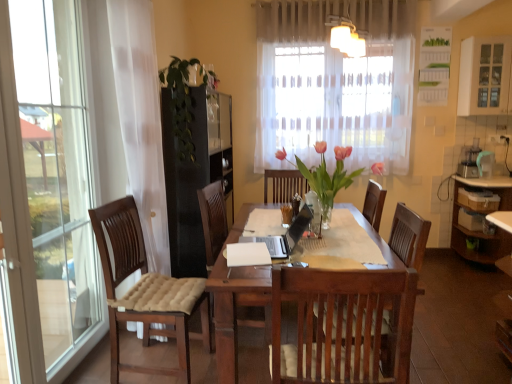
The image size is (512, 384). Describe the element at coordinates (327, 175) in the screenshot. I see `translucent glass vase at center, the second floral arrangement in the back-to-front sequence` at that location.

What do you see at coordinates (484, 75) in the screenshot? I see `white glass cabinet at upper right` at bounding box center [484, 75].

Image resolution: width=512 pixels, height=384 pixels. Find the location of `green leafy plant at center, which is the second floral arrangement in front-to-back order`. green leafy plant at center, which is the second floral arrangement in front-to-back order is located at coordinates (184, 101).

Locate an element on the screen. translucent glass vase at center, the second floral arrangement in the back-to-front sequence is located at coordinates (327, 175).

In the scene shown: How distant is translucent glass vase at center, the second floral arrangement in the back-to-front sequence, from white glass cabinet at upper right?

translucent glass vase at center, the second floral arrangement in the back-to-front sequence, and white glass cabinet at upper right are 6.65 feet apart.

Is translucent glass vase at center, the first floral arrangement positioned from the right, far from white glass cabinet at upper right?

Indeed, translucent glass vase at center, the first floral arrangement positioned from the right, is not near white glass cabinet at upper right.

Which of these two, translucent glass vase at center, the first floral arrangement positioned from the right, or white glass cabinet at upper right, is smaller?

white glass cabinet at upper right is smaller.

Looking at their sizes, would you say translucent glass vase at center, acting as the first floral arrangement starting from the front, is wider or thinner than white glass cabinet at upper right?

Considering their sizes, translucent glass vase at center, acting as the first floral arrangement starting from the front, looks broader than white glass cabinet at upper right.

Based on the photo, is green leafy plant at center, placed as the 1th floral arrangement when sorted from left to right, taller than translucent glass vase at center, the first floral arrangement positioned from the right?

Correct, green leafy plant at center, placed as the 1th floral arrangement when sorted from left to right, is much taller as translucent glass vase at center, the first floral arrangement positioned from the right.

This screenshot has width=512, height=384. Find the location of `floral arrangement above the translucent glass vase at center, acting as the first floral arrangement starting from the front (from a real-world perspective)`. floral arrangement above the translucent glass vase at center, acting as the first floral arrangement starting from the front (from a real-world perspective) is located at coordinates tap(184, 101).

Visually, is green leafy plant at center, which is the second floral arrangement in right-to-left order, positioned to the left or to the right of translucent glass vase at center, acting as the 2th floral arrangement starting from the left?

green leafy plant at center, which is the second floral arrangement in right-to-left order, is positioned on translucent glass vase at center, acting as the 2th floral arrangement starting from the left,'s left side.

Is green leafy plant at center, the first floral arrangement positioned from the back, in contact with translucent glass vase at center, acting as the first floral arrangement starting from the front?

No, green leafy plant at center, the first floral arrangement positioned from the back, is not touching translucent glass vase at center, acting as the first floral arrangement starting from the front.

Is white glass cabinet at upper right located outside green leafy plant at center, which is the second floral arrangement in right-to-left order?

That's correct, white glass cabinet at upper right is outside of green leafy plant at center, which is the second floral arrangement in right-to-left order.

Between white glass cabinet at upper right and green leafy plant at center, which is the second floral arrangement in right-to-left order, which one has larger size?

With larger size is green leafy plant at center, which is the second floral arrangement in right-to-left order.

From the image's perspective, between white glass cabinet at upper right and green leafy plant at center, which is the second floral arrangement in front-to-back order, who is located below?

green leafy plant at center, which is the second floral arrangement in front-to-back order, appears lower in the image.

Considering the positions of objects green leafy plant at center, the first floral arrangement positioned from the back, and white glass cabinet at upper right in the image provided, who is behind, green leafy plant at center, the first floral arrangement positioned from the back, or white glass cabinet at upper right?

white glass cabinet at upper right is further from the camera.

From the image's perspective, which object appears higher, green leafy plant at center, which is the second floral arrangement in right-to-left order, or white glass cabinet at upper right?

white glass cabinet at upper right, from the image's perspective.

Is green leafy plant at center, which is the second floral arrangement in front-to-back order, not near white glass cabinet at upper right?

Indeed, green leafy plant at center, which is the second floral arrangement in front-to-back order, is not near white glass cabinet at upper right.

From the white glass cabinet at upper right, count 1st floral arrangements forward and point to it. Please provide its 2D coordinates.

[(184, 101)]

Could green leafy plant at center, placed as the 1th floral arrangement when sorted from left to right, be considered to be inside translucent glass vase at center, acting as the 2th floral arrangement starting from the left?

That's incorrect, green leafy plant at center, placed as the 1th floral arrangement when sorted from left to right, is not inside translucent glass vase at center, acting as the 2th floral arrangement starting from the left.

In the scene shown: Can you tell me how much translucent glass vase at center, the second floral arrangement in the back-to-front sequence, and green leafy plant at center, placed as the 1th floral arrangement when sorted from left to right, differ in facing direction?

There is a 4.31-degree angle between the facing directions of translucent glass vase at center, the second floral arrangement in the back-to-front sequence, and green leafy plant at center, placed as the 1th floral arrangement when sorted from left to right.

Between translucent glass vase at center, acting as the 2th floral arrangement starting from the left, and green leafy plant at center, placed as the 1th floral arrangement when sorted from left to right, which one has smaller width?

green leafy plant at center, placed as the 1th floral arrangement when sorted from left to right.

From the image's perspective, is white glass cabinet at upper right on translucent glass vase at center, the first floral arrangement positioned from the right?

Yes.

In the scene shown: Considering their positions, is white glass cabinet at upper right located in front of or behind translucent glass vase at center, acting as the 2th floral arrangement starting from the left?

Visually, white glass cabinet at upper right is located behind translucent glass vase at center, acting as the 2th floral arrangement starting from the left.

From a real-world perspective, is white glass cabinet at upper right physically below translucent glass vase at center, acting as the first floral arrangement starting from the front?

No, from a real-world perspective, white glass cabinet at upper right is not beneath translucent glass vase at center, acting as the first floral arrangement starting from the front.

Considering the relative sizes of white glass cabinet at upper right and translucent glass vase at center, the first floral arrangement positioned from the right, in the image provided, is white glass cabinet at upper right smaller than translucent glass vase at center, the first floral arrangement positioned from the right,?

Yes.

At what (x,y) coordinates should I click in order to perform the action: click on floral arrangement that is the 1st one when counting leftward from the white glass cabinet at upper right. Please return your answer as a coordinate pair (x, y). The image size is (512, 384). Looking at the image, I should click on click(327, 175).

Locate an element on the screen. The height and width of the screenshot is (384, 512). floral arrangement below the green leafy plant at center, which is the second floral arrangement in front-to-back order (from a real-world perspective) is located at coordinates (327, 175).

Estimate the real-world distances between objects in this image. Which object is closer to white glass cabinet at upper right, translucent glass vase at center, the first floral arrangement positioned from the right, or green leafy plant at center, which is the second floral arrangement in right-to-left order?

Based on the image, translucent glass vase at center, the first floral arrangement positioned from the right, appears to be nearer to white glass cabinet at upper right.

Based on the photo, estimate the real-world distances between objects in this image. Which object is further from white glass cabinet at upper right, green leafy plant at center, which is the second floral arrangement in right-to-left order, or translucent glass vase at center, the first floral arrangement positioned from the right?

Among the two, green leafy plant at center, which is the second floral arrangement in right-to-left order, is located further to white glass cabinet at upper right.

Estimate the real-world distances between objects in this image. Which object is closer to translucent glass vase at center, acting as the 2th floral arrangement starting from the left, white glass cabinet at upper right or green leafy plant at center, the first floral arrangement positioned from the back?

green leafy plant at center, the first floral arrangement positioned from the back.

Looking at the image, which one is located closer to translucent glass vase at center, the second floral arrangement in the back-to-front sequence, green leafy plant at center, placed as the 1th floral arrangement when sorted from left to right, or white glass cabinet at upper right?

green leafy plant at center, placed as the 1th floral arrangement when sorted from left to right, is closer to translucent glass vase at center, the second floral arrangement in the back-to-front sequence.

Which object lies nearer to the anchor point green leafy plant at center, placed as the 1th floral arrangement when sorted from left to right, white glass cabinet at upper right or translucent glass vase at center, acting as the 2th floral arrangement starting from the left?

The object closer to green leafy plant at center, placed as the 1th floral arrangement when sorted from left to right, is translucent glass vase at center, acting as the 2th floral arrangement starting from the left.

From the picture: Considering their positions, is translucent glass vase at center, the second floral arrangement in the back-to-front sequence, positioned further to green leafy plant at center, which is the second floral arrangement in front-to-back order, than white glass cabinet at upper right?

Based on the image, white glass cabinet at upper right appears to be further to green leafy plant at center, which is the second floral arrangement in front-to-back order.

You are a GUI agent. You are given a task and a screenshot of the screen. Output one action in this format:
    pyautogui.click(x=<x>, y=<y>)
    Task: Click on the floral arrangement located between green leafy plant at center, placed as the 1th floral arrangement when sorted from left to right, and white glass cabinet at upper right in the left-right direction
    The image size is (512, 384).
    Given the screenshot: What is the action you would take?
    pyautogui.click(x=327, y=175)